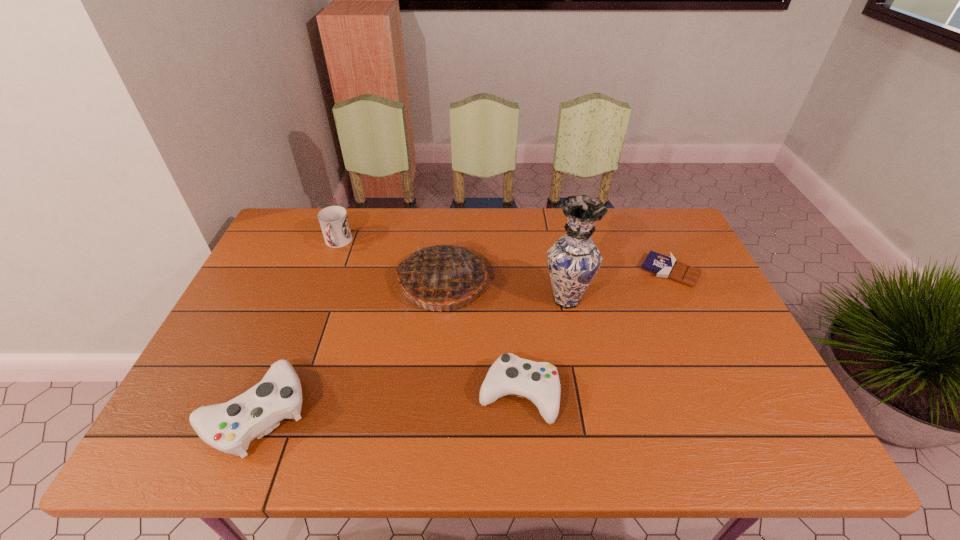
The width and height of the screenshot is (960, 540). Identify the location of free spot between the rightmost object and the tallest object. (618, 285).

This screenshot has height=540, width=960. In order to click on vacant area that lies between the tallest object and the shortest object in this screenshot , I will do `click(618, 285)`.

Locate an element on the screen. free spot between the fourth shortest object and the left control is located at coordinates (297, 327).

You are a GUI agent. You are given a task and a screenshot of the screen. Output one action in this format:
    pyautogui.click(x=<x>, y=<y>)
    Task: Click on the free point between the right control and the fourth shortest object
    The width and height of the screenshot is (960, 540).
    Given the screenshot: What is the action you would take?
    pyautogui.click(x=428, y=319)

Choose which object is the fifth nearest neighbor to the pie. Please provide its 2D coordinates. Your answer should be formatted as a tuple, i.e. [(x, y)], where the tuple contains the x and y coordinates of a point satisfying the conditions above.

[(667, 267)]

Identify which object is located as the third nearest to the taller control. Please provide its 2D coordinates. Your answer should be formatted as a tuple, i.e. [(x, y)], where the tuple contains the x and y coordinates of a point satisfying the conditions above.

[(333, 220)]

The image size is (960, 540). In order to click on vacant space that satisfies the following two spatial constraints: 1. on the back side of the chocolate bar; 2. on the left side of the right control in this screenshot , I will do `click(510, 271)`.

In order to click on vacant position in the image that satisfies the following two spatial constraints: 1. on the back side of the shortest object; 2. on the left side of the second tallest object in this screenshot , I will do `click(444, 271)`.

You are a GUI agent. You are given a task and a screenshot of the screen. Output one action in this format:
    pyautogui.click(x=<x>, y=<y>)
    Task: Click on the vacant space that satisfies the following two spatial constraints: 1. on the back side of the tallest object; 2. on the left side of the left control
    This screenshot has width=960, height=540.
    Given the screenshot: What is the action you would take?
    pyautogui.click(x=301, y=300)